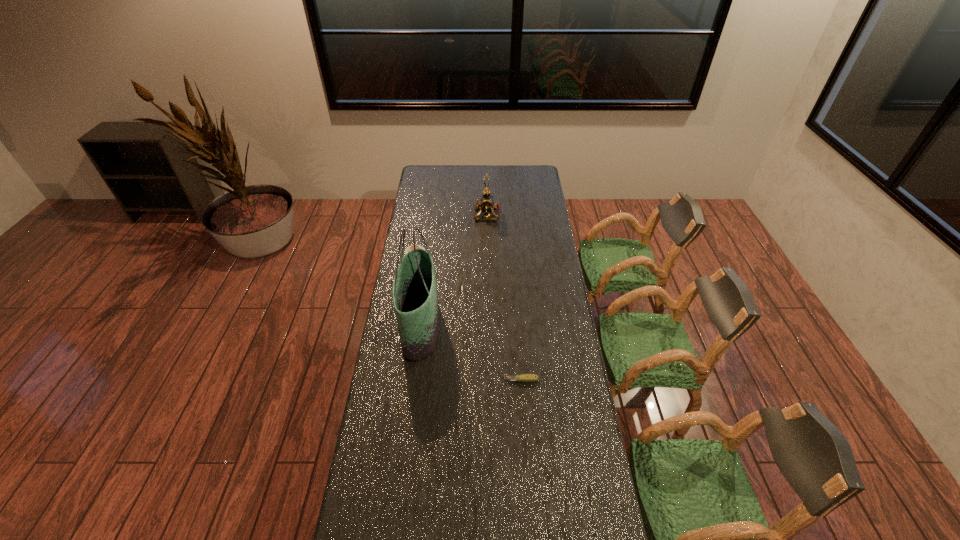
Where is `vacant space located 0.130m on the front of the telephone, featuring the rotary dial`? The height and width of the screenshot is (540, 960). vacant space located 0.130m on the front of the telephone, featuring the rotary dial is located at coordinates point(450,214).

Where is `vacant space located on the front of the telephone, featuring the rotary dial`? This screenshot has height=540, width=960. vacant space located on the front of the telephone, featuring the rotary dial is located at coordinates (436, 214).

You are a GUI agent. You are given a task and a screenshot of the screen. Output one action in this format:
    pyautogui.click(x=<x>, y=<y>)
    Task: Click on the blank space located on the right of the third tallest object
    
    Given the screenshot: What is the action you would take?
    pyautogui.click(x=477, y=253)

At what (x,y) coordinates should I click in order to perform the action: click on vacant space located 0.110m on the front of the pocketknife. Please return your answer as a coordinate pair (x, y). The height and width of the screenshot is (540, 960). Looking at the image, I should click on (523, 410).

You are a GUI agent. You are given a task and a screenshot of the screen. Output one action in this format:
    pyautogui.click(x=<x>, y=<y>)
    Task: Click on the tote bag that is at the left edge
    
    Given the screenshot: What is the action you would take?
    pyautogui.click(x=415, y=295)

Find the location of `pudding at the left edge`. pudding at the left edge is located at coordinates (409, 248).

Identify the location of free region at the far edge. (514, 179).

In the image, there is a desktop. Where is `vacant space at the left edge`? vacant space at the left edge is located at coordinates (372, 505).

You are a GUI agent. You are given a task and a screenshot of the screen. Output one action in this format:
    pyautogui.click(x=<x>, y=<y>)
    Task: Click on the vacant space at the right edge of the desktop
    
    Given the screenshot: What is the action you would take?
    pyautogui.click(x=577, y=432)

I want to click on vacant space at the far left corner, so click(x=434, y=181).